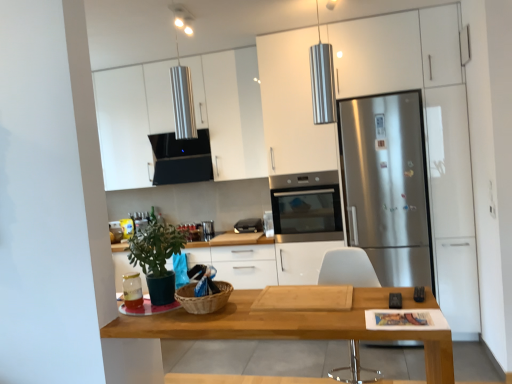
The height and width of the screenshot is (384, 512). What are the coordinates of `vacant space in front of green matte plant at lower left` in the screenshot? It's located at (151, 315).